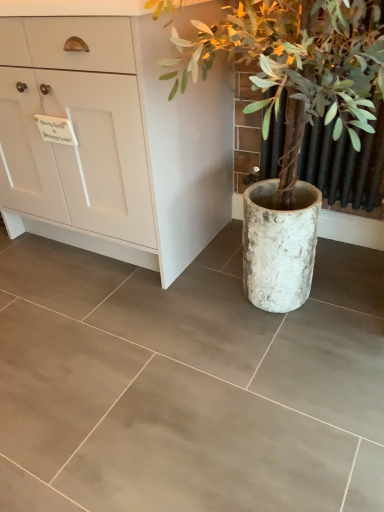
Question: Is white matte cabinet at left bigger or smaller than white textured pot at right?

Choices:
 (A) small
 (B) big

Answer: (B)

Question: Visually, is white matte cabinet at left positioned to the left or to the right of white textured pot at right?

Choices:
 (A) right
 (B) left

Answer: (B)

Question: Considering their positions, is white matte cabinet at left located in front of or behind white textured pot at right?

Choices:
 (A) front
 (B) behind

Answer: (B)

Question: In terms of size, does white textured pot at right appear bigger or smaller than white matte cabinet at left?

Choices:
 (A) big
 (B) small

Answer: (B)

Question: In terms of height, does white textured pot at right look taller or shorter compared to white matte cabinet at left?

Choices:
 (A) tall
 (B) short

Answer: (A)

Question: From a real-world perspective, is white textured pot at right positioned above or below white matte cabinet at left?

Choices:
 (A) above
 (B) below

Answer: (A)

Question: In the image, is white textured pot at right positioned in front of or behind white matte cabinet at left?

Choices:
 (A) behind
 (B) front

Answer: (B)